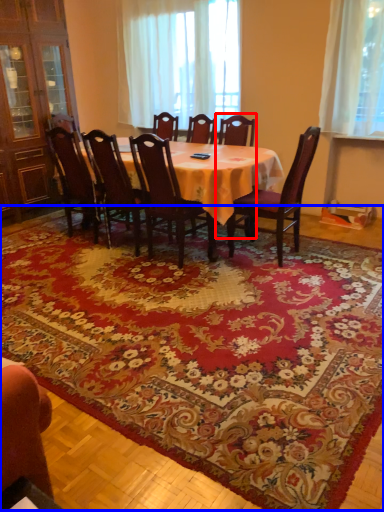
Question: Which object appears farthest to the camera in this image, chair (highlighted by a red box) or mat (highlighted by a blue box)?

Choices:
 (A) chair
 (B) mat

Answer: (A)